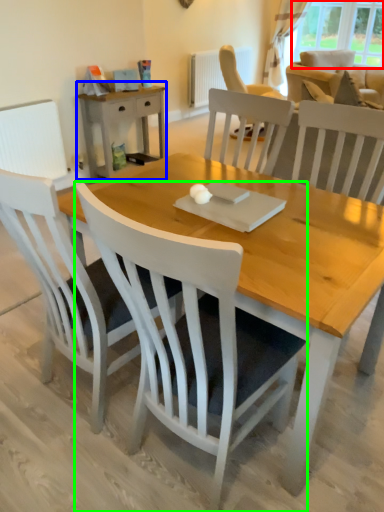
Question: Estimate the real-world distances between objects in this image. Which object is closer to window (highlighted by a red box), nightstand (highlighted by a blue box) or chair (highlighted by a green box)?

Choices:
 (A) nightstand
 (B) chair

Answer: (A)